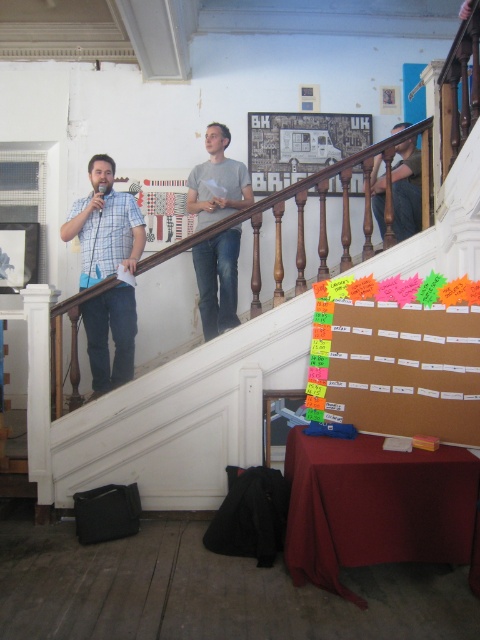
You are standing at the bottom of the staircase in the image. There are two points marked on the wall, one at coordinates point (421, 356) and the other at point (228, 186). Which point is closer to you?

Point (421, 356) is closer to the camera than point (228, 186), so the point at coordinates point (421, 356) is closer to you.

You are organizing a community event and need to place a decorative banner between the neon paper notes at upper right and the gray matte shirt at upper center. The banner is 3.5 feet long. Will it fit without overlapping either object?

The distance between the neon paper notes at upper right and the gray matte shirt at upper center is 4.03 feet. Since the banner is 3.5 feet long, it will fit between them without overlapping either object as there is enough space.